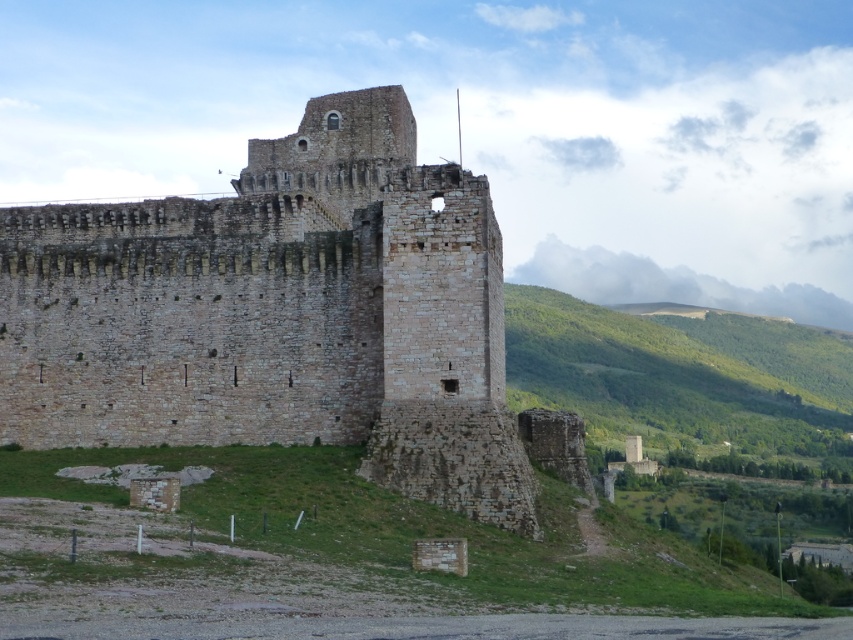
You are standing at the base of the hill looking up at the fortress. Which object is nearer to you, the brown stone castle at center or the green leafy hillside at right?

The brown stone castle at center is closer to the viewer than the green leafy hillside at right.

You are standing at the base of the hill where the dirt path begins. You want to reach the brown stone castle at center. According to the coordinates provided, in which direction should you walk to reach it?

The brown stone castle at center is located at coordinates point (279,314). Since you are at the base of the hill where the dirt path begins, you should walk upwards along the dirt path leading to the fortress to reach the brown stone castle at center.

You are a tourist standing at the base of the brown stone castle at center and want to take a photo that includes both the castle and the green leafy hillside at right. Given their sizes, which object should you zoom in on more to ensure both are visible in the frame?

The brown stone castle at center is smaller than the green leafy hillside at right. To include both in the photo, you should zoom in more on the green leafy hillside at right since it is larger and requires a wider angle to capture its entirety while still fitting the smaller castle.